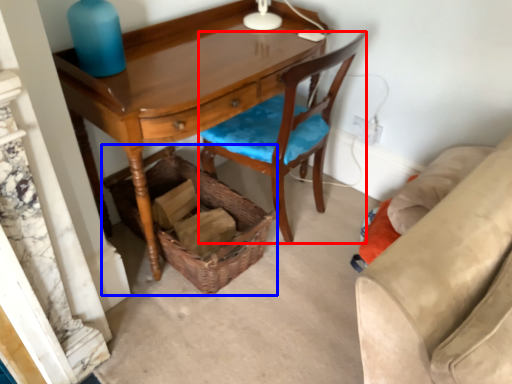
Question: Which of the following is the farthest to the observer, chair (highlighted by a red box) or picnic basket (highlighted by a blue box)?

Choices:
 (A) chair
 (B) picnic basket

Answer: (B)